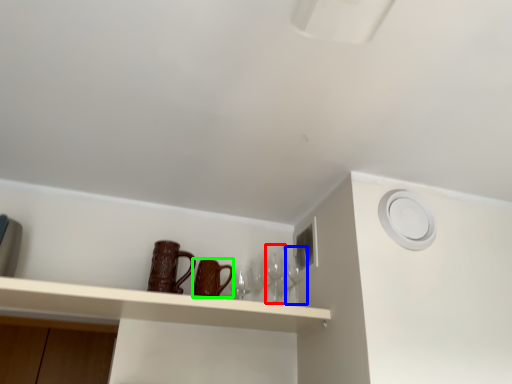
Question: Which is farther away from wine glass (highlighted by a red box)? wine glass (highlighted by a blue box) or mug (highlighted by a green box)?

Choices:
 (A) wine glass
 (B) mug

Answer: (B)